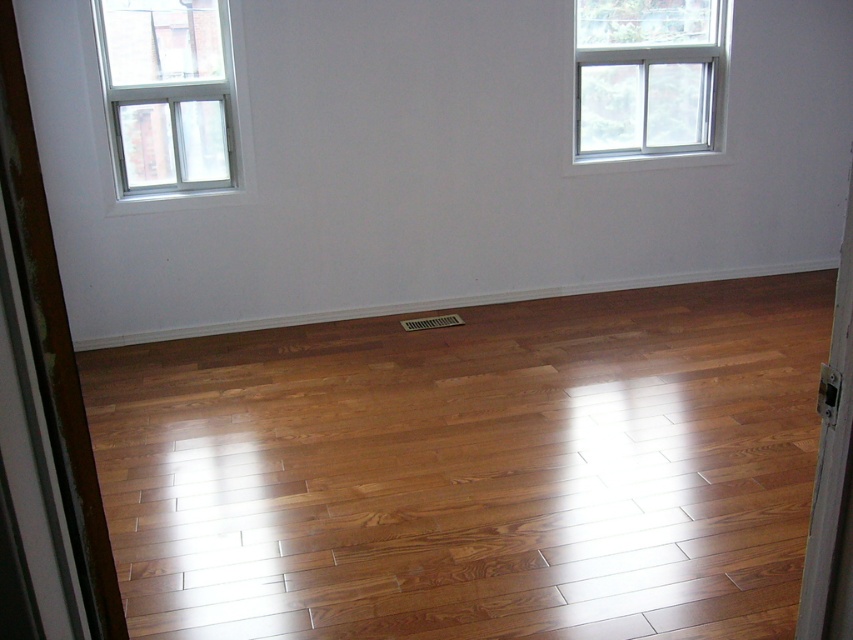
Can you confirm if shiny brown wood floor at center is positioned to the right of white plastic window at upper left?

Indeed, shiny brown wood floor at center is positioned on the right side of white plastic window at upper left.

Is shiny brown wood floor at center taller than white plastic window at upper left?

Yes, shiny brown wood floor at center is taller than white plastic window at upper left.

Describe the element at coordinates (473, 470) in the screenshot. I see `shiny brown wood floor at center` at that location.

Identify the location of shiny brown wood floor at center. (473, 470).

Is point (154, 166) positioned after point (589, 145)?

No, it is in front of (589, 145).

I want to click on white plastic window at upper left, so click(167, 93).

This screenshot has height=640, width=853. What do you see at coordinates (167, 93) in the screenshot?
I see `white plastic window at upper left` at bounding box center [167, 93].

Where is `white plastic window at upper left`? This screenshot has height=640, width=853. white plastic window at upper left is located at coordinates (167, 93).

Is point (651, 380) positioned behind point (589, 113)?

No, it is not.

Which is in front, point (328, 496) or point (688, 13)?

Positioned in front is point (328, 496).

Between point (619, 390) and point (593, 118), which one is positioned behind?

The point (593, 118) is behind.

Image resolution: width=853 pixels, height=640 pixels. I want to click on shiny brown wood floor at center, so click(473, 470).